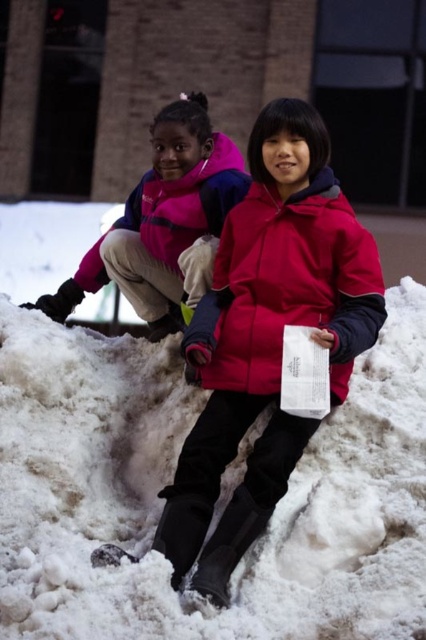
Looking at this image, you are a photographer trying to capture the children playing in the snow. You need to focus your camera on the white fluffy snow at center. What are the coordinates where you should aim your camera?

The coordinates for the white fluffy snow at center are at point [172,476].

You are a photographer trying to capture a closeup shot of the white fluffy snow at center while also including the matte pink jacket at upper left in the frame. Based on their positions, will you need to adjust your camera focus to ensure both are in focus?

The white fluffy snow at center is closer to the viewer than the matte pink jacket at upper left. To capture both in focus, you would need to adjust the camera focus to account for the distance between them.